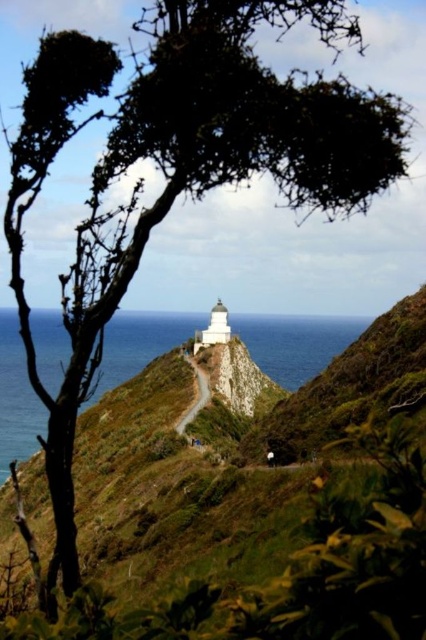
Does blue water at center have a lesser height compared to smooth concrete path at center?

No.

Locate an element on the screen. The height and width of the screenshot is (640, 426). blue water at center is located at coordinates (296, 342).

You are a GUI agent. You are given a task and a screenshot of the screen. Output one action in this format:
    pyautogui.click(x=<x>, y=<y>)
    Task: Click on the blue water at center
    This screenshot has width=426, height=640.
    Given the screenshot: What is the action you would take?
    pyautogui.click(x=296, y=342)